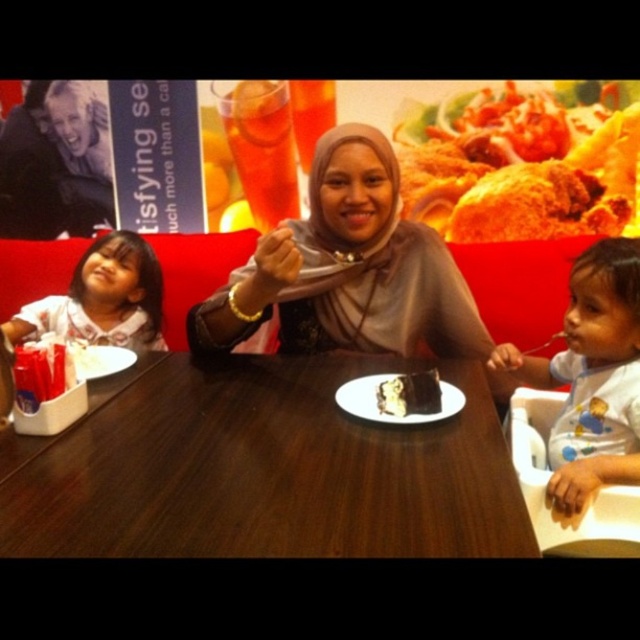
Question: Which point is farther to the camera?

Choices:
 (A) (28, 493)
 (B) (80, 282)
 (C) (330, 237)

Answer: (B)

Question: Observing the image, what is the correct spatial positioning of matte brown hijab at center in reference to white ceramic plate at center?

Choices:
 (A) left
 (B) right

Answer: (A)

Question: Does golden crispy chicken at center come in front of white ceramic plate at center?

Choices:
 (A) yes
 (B) no

Answer: (B)

Question: Is wooden table at center to the left of white shirt at left from the viewer's perspective?

Choices:
 (A) no
 (B) yes

Answer: (A)

Question: Estimate the real-world distances between objects in this image. Which object is farther from the wooden table at center?

Choices:
 (A) white ceramic plate at center
 (B) smooth white shirt at right
 (C) white shirt at left
 (D) chocolate cake at center

Answer: (C)

Question: Considering the real-world distances, which object is closest to the smooth white shirt at right?

Choices:
 (A) white shirt at left
 (B) white ceramic plate at center
 (C) chocolate cake at center
 (D) wooden table at center

Answer: (B)